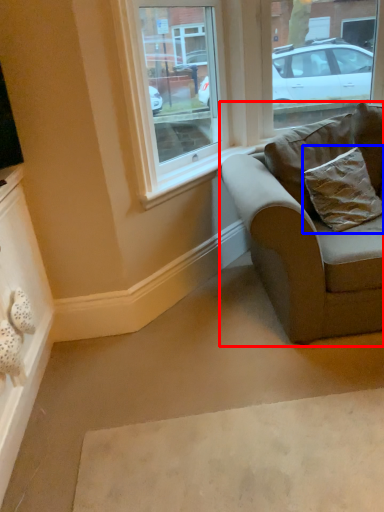
Question: Which object is further to the camera taking this photo, studio couch (highlighted by a red box) or pillow (highlighted by a blue box)?

Choices:
 (A) studio couch
 (B) pillow

Answer: (B)